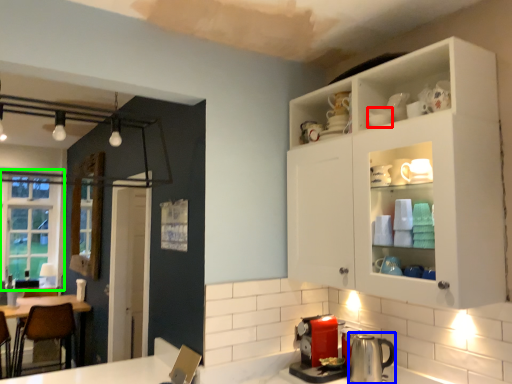
Question: Which object is positioned farthest from tableware (highlighted by a red box)? Select from appliance (highlighted by a blue box) and window (highlighted by a green box).

Choices:
 (A) appliance
 (B) window

Answer: (B)